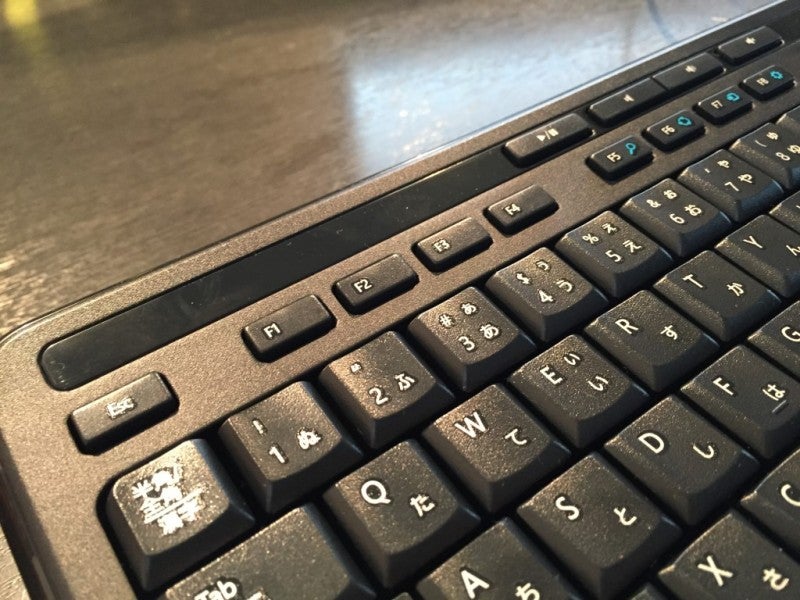
At what (x,y) coordinates should I click in order to perform the action: click on keyboard. Please return your answer as a coordinate pair (x, y). Image resolution: width=800 pixels, height=600 pixels. Looking at the image, I should click on (205, 371).